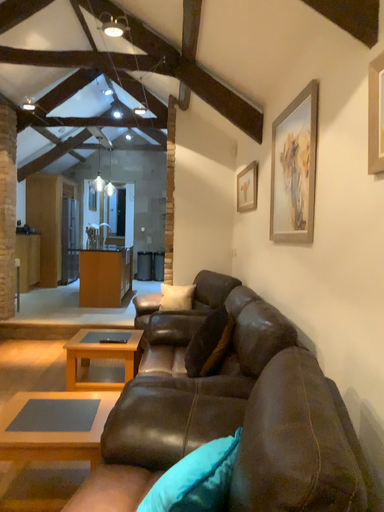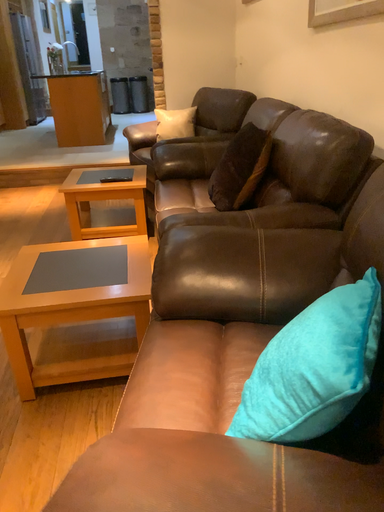
Question: Which way did the camera rotate in the video?

Choices:
 (A) rotated upward
 (B) rotated downward

Answer: (B)